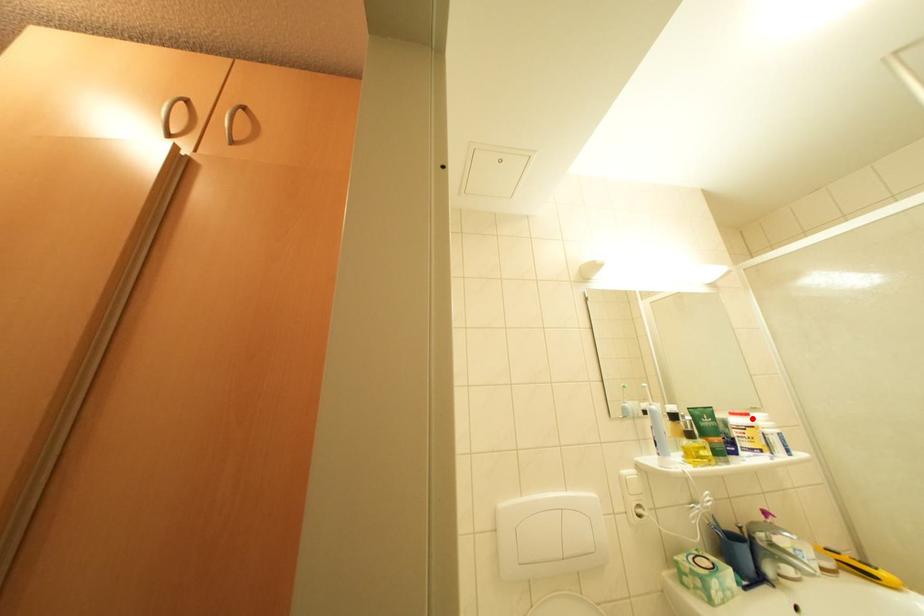
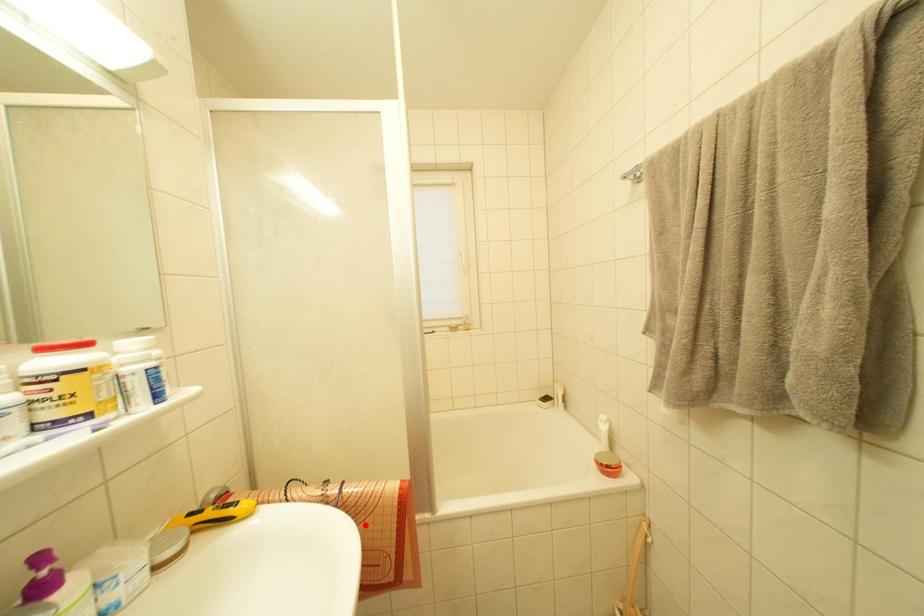
I am providing you with two images of the same scene from different viewpoints. A red point is marked on the first image and another point is marked on the second image. Is the red point in image1 aligned with the point shown in image2?

No